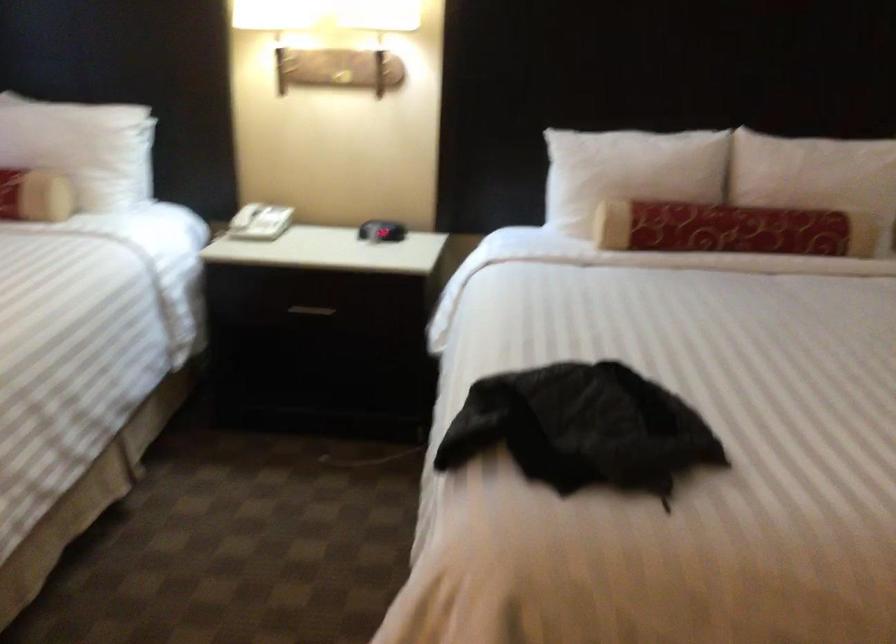
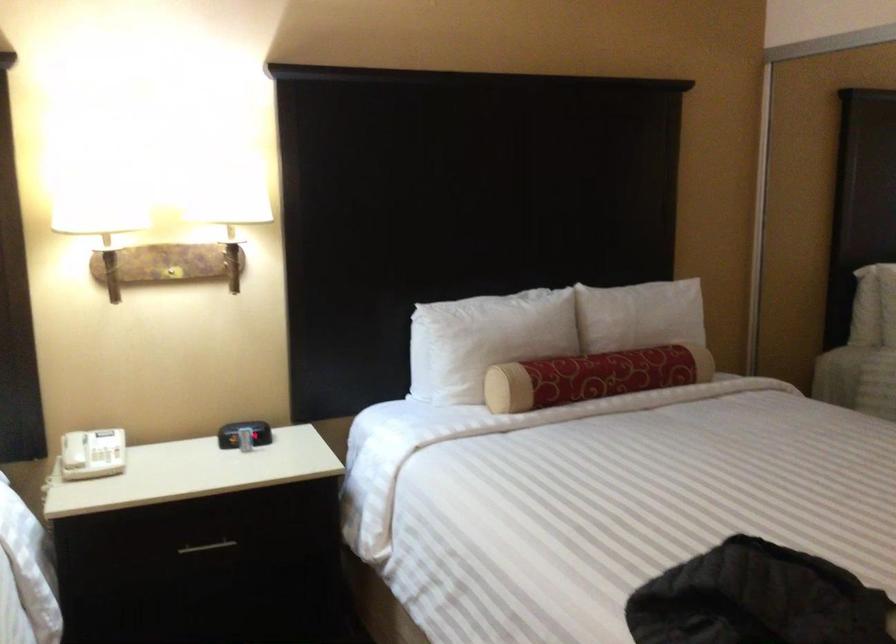
Where in the second image is the point corresponding to point (374, 225) from the first image?

(244, 433)